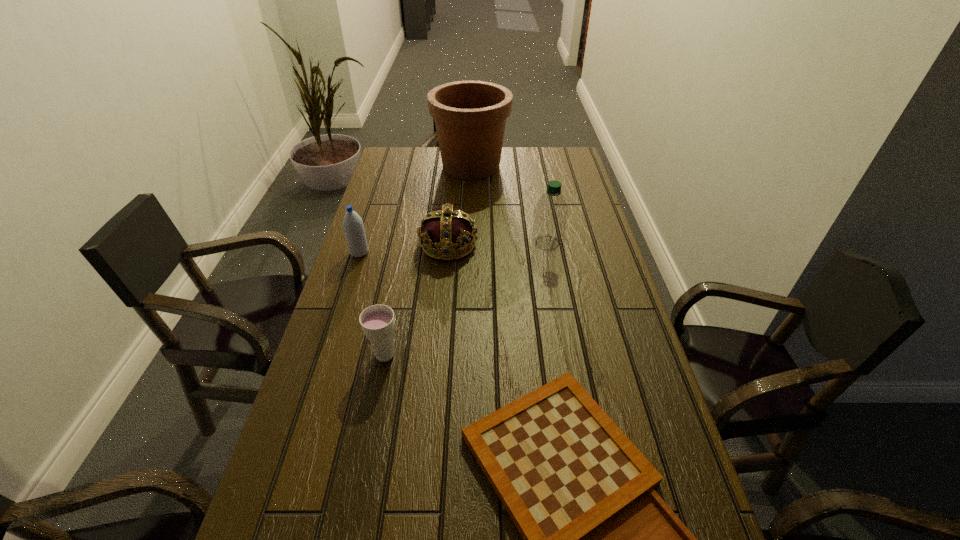
Where is `free region located 0.200m on the right of the left water bottle`? Image resolution: width=960 pixels, height=540 pixels. free region located 0.200m on the right of the left water bottle is located at coordinates pos(432,253).

Where is `vacant space situated on the left of the crown`? Image resolution: width=960 pixels, height=540 pixels. vacant space situated on the left of the crown is located at coordinates (388, 245).

This screenshot has height=540, width=960. I want to click on vacant area located on the left of the cup, so click(337, 355).

Where is `object at the far edge`? object at the far edge is located at coordinates (470, 116).

The width and height of the screenshot is (960, 540). Find the location of `water bottle that is at the left edge`. water bottle that is at the left edge is located at coordinates (353, 226).

Find the location of `cup present at the left edge`. cup present at the left edge is located at coordinates (377, 321).

The height and width of the screenshot is (540, 960). In order to click on object that is at the right edge in this screenshot , I will do `click(551, 212)`.

Locate an element on the screen. This screenshot has height=540, width=960. vacant space at the left edge of the desktop is located at coordinates (353, 298).

In the image, there is a desktop. Where is `free space at the right edge`? Image resolution: width=960 pixels, height=540 pixels. free space at the right edge is located at coordinates (619, 394).

Identify the location of vacant space at the far right corner of the desktop. The image size is (960, 540). (567, 158).